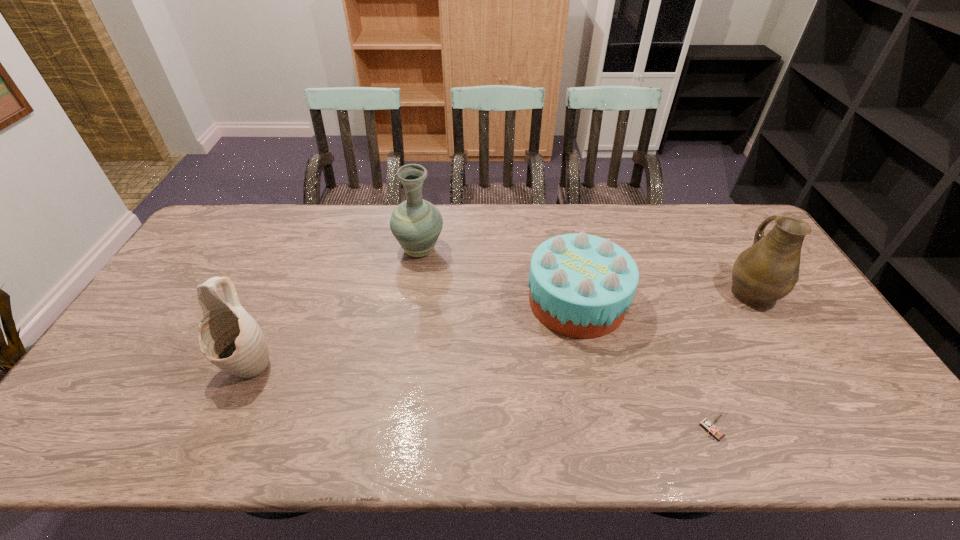
Where is `the second pitcher from right to left`? The height and width of the screenshot is (540, 960). the second pitcher from right to left is located at coordinates (416, 223).

Where is `the farthest object`? The image size is (960, 540). the farthest object is located at coordinates (416, 223).

Find the location of `the leftmost object`. the leftmost object is located at coordinates (231, 339).

Locate an element on the screen. The height and width of the screenshot is (540, 960). the leftmost pitcher is located at coordinates (231, 339).

Locate an element on the screen. the rightmost object is located at coordinates (767, 271).

You are a GUI agent. You are given a task and a screenshot of the screen. Output one action in this format:
    pyautogui.click(x=<x>, y=<y>)
    Task: Click on the rightmost pitcher
    The width and height of the screenshot is (960, 540).
    Given the screenshot: What is the action you would take?
    pyautogui.click(x=767, y=271)

The image size is (960, 540). I want to click on the fourth tallest object, so click(x=581, y=285).

Find the location of a particular element. Image resolution: width=960 pixels, height=540 pixels. the third object from right to left is located at coordinates (581, 285).

At what (x,y) coordinates should I click in order to perform the action: click on matchbox. Please return your answer as a coordinate pair (x, y). The width and height of the screenshot is (960, 540). Looking at the image, I should click on (711, 427).

The image size is (960, 540). In order to click on the nearest object in this screenshot , I will do `click(711, 427)`.